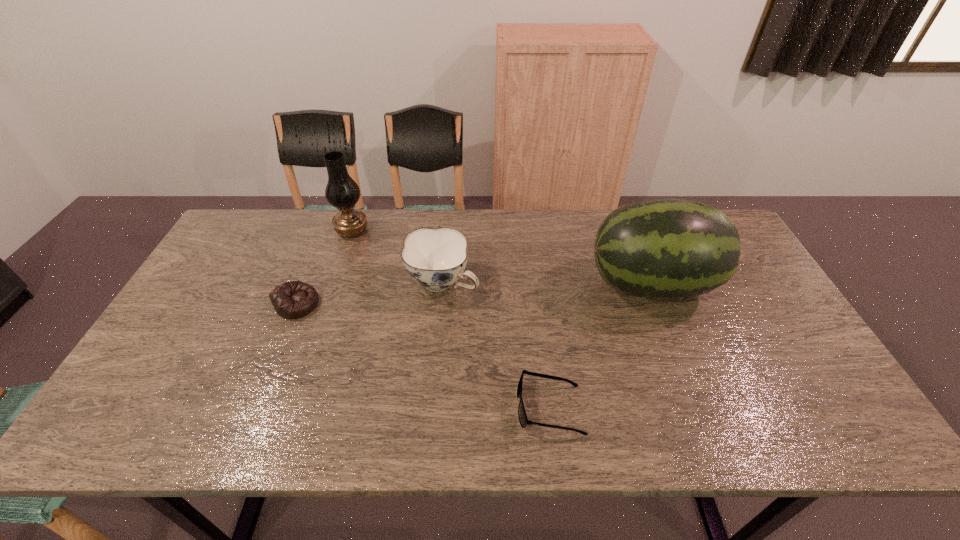
The height and width of the screenshot is (540, 960). What are the coordinates of `oil lamp` in the screenshot? It's located at (342, 192).

You are a GUI agent. You are given a task and a screenshot of the screen. Output one action in this format:
    pyautogui.click(x=<x>, y=<y>)
    Task: Click on the watermelon
    
    Given the screenshot: What is the action you would take?
    pyautogui.click(x=663, y=248)

Where is `chinaware`? chinaware is located at coordinates (436, 258).

Where is `the third object from left to right`? The height and width of the screenshot is (540, 960). the third object from left to right is located at coordinates (436, 258).

At what (x,y) coordinates should I click in order to perform the action: click on beanbag. Please return your answer as a coordinate pair (x, y). Looking at the image, I should click on (293, 299).

Find the location of a particular element. The width and height of the screenshot is (960, 540). sunglasses is located at coordinates (523, 420).

At what (x,y) coordinates should I click in order to perform the action: click on the nearest object. Please return your answer as a coordinate pair (x, y). The width and height of the screenshot is (960, 540). Looking at the image, I should click on (523, 420).

Locate an element on the screen. The width and height of the screenshot is (960, 540). blank space located on the back of the farthest object is located at coordinates (358, 212).

Image resolution: width=960 pixels, height=540 pixels. I want to click on free space located on the right of the watermelon, so click(x=747, y=285).

At what (x,y) coordinates should I click in order to perform the action: click on vacant space located on the left of the chinaware. Please return your answer as a coordinate pair (x, y). This screenshot has height=540, width=960. Looking at the image, I should click on (302, 283).